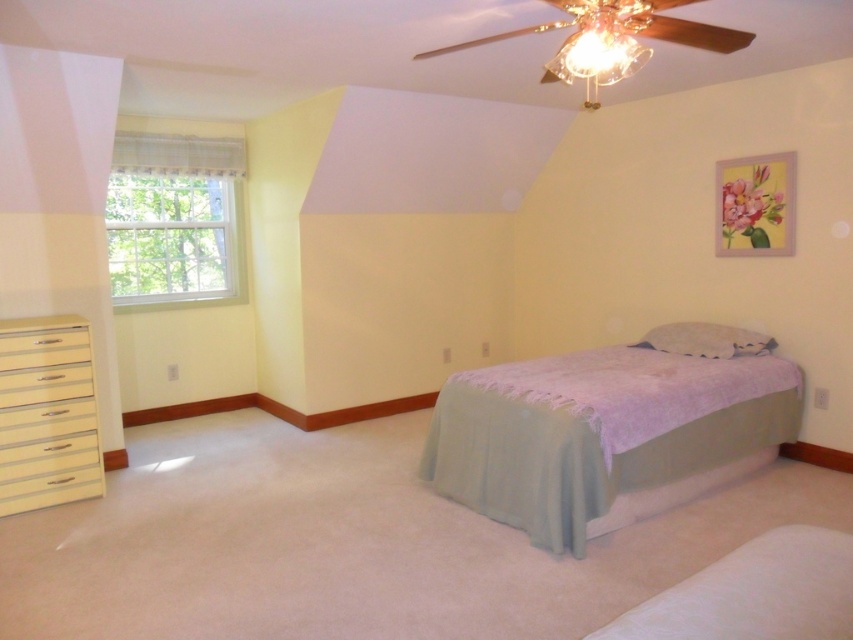
Question: Which object is farther from the camera taking this photo?

Choices:
 (A) white fabric pillow at center
 (B) clear glass window at upper left
 (C) cream glossy dresser at lower left

Answer: (B)

Question: Considering the relative positions of light blue fabric bedspread at center and cream glossy dresser at lower left in the image provided, where is light blue fabric bedspread at center located with respect to cream glossy dresser at lower left?

Choices:
 (A) right
 (B) left

Answer: (A)

Question: Among these points, which one is nearest to the camera?

Choices:
 (A) (717, 422)
 (B) (669, 330)

Answer: (A)

Question: Is clear glass window at upper left thinner than light blue fabric bedspread at center?

Choices:
 (A) no
 (B) yes

Answer: (A)

Question: Which of the following is the closest to the observer?

Choices:
 (A) light blue fabric bed at center
 (B) white fabric pillow at center
 (C) clear glass window at upper left

Answer: (A)

Question: Does light blue fabric bedspread at center have a smaller size compared to white fabric pillow at center?

Choices:
 (A) yes
 (B) no

Answer: (B)